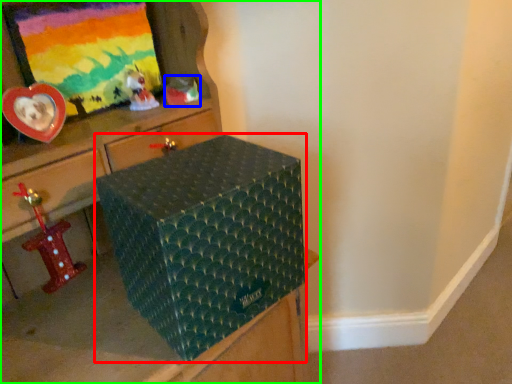
Question: Which is farther away from box (highlighted by a red box)? toy (highlighted by a blue box) or furniture (highlighted by a green box)?

Choices:
 (A) toy
 (B) furniture

Answer: (A)